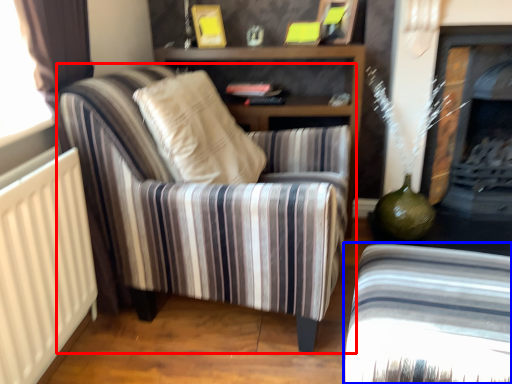
Question: Which object is further to the camera taking this photo, chair (highlighted by a red box) or chair (highlighted by a blue box)?

Choices:
 (A) chair
 (B) chair

Answer: (A)